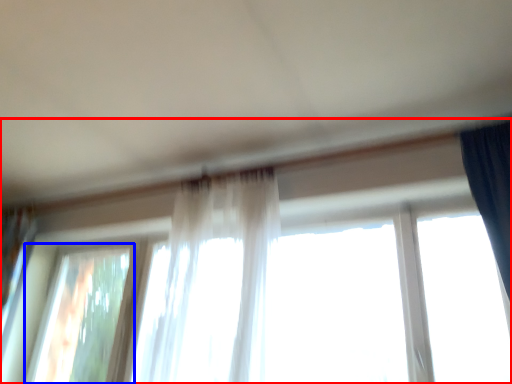
Question: Which of the following is the closest to the observer, window (highlighted by a red box) or window (highlighted by a blue box)?

Choices:
 (A) window
 (B) window

Answer: (A)